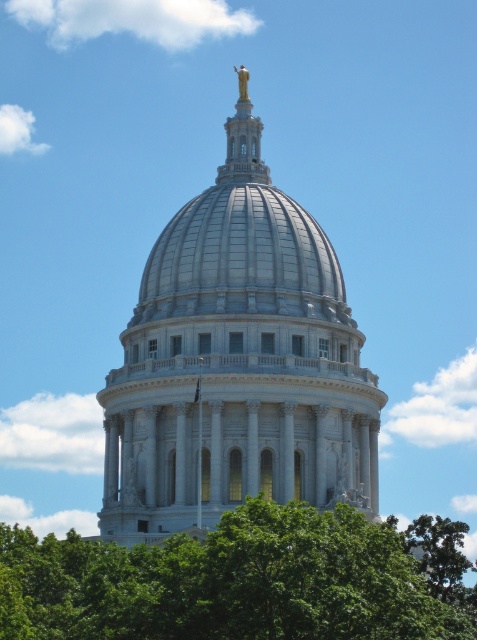
Is green leafy tree at lower center shorter than goldmaterial/texturestatue at upper center?

Correct, green leafy tree at lower center is not as tall as goldmaterial/texturestatue at upper center.

Who is taller, green leafy tree at lower center or goldmaterial/texturestatue at upper center?

goldmaterial/texturestatue at upper center is taller.

Identify the location of green leafy tree at lower center. The height and width of the screenshot is (640, 477). (227, 582).

Between white marble dome at center and goldmaterial/texturestatue at upper center, which one appears on the left side from the viewer's perspective?

white marble dome at center

Who is more distant from viewer, (306, 458) or (232, 125)?

The point (232, 125) is more distant.

The image size is (477, 640). I want to click on white marble dome at center, so click(x=237, y=372).

Where is `white marble dome at center`? The height and width of the screenshot is (640, 477). white marble dome at center is located at coordinates pyautogui.click(x=237, y=372).

Based on the photo, does white marble dome at center appear over green leafy tree at lower center?

Indeed, white marble dome at center is positioned over green leafy tree at lower center.

Locate an element on the screen. This screenshot has height=640, width=477. white marble dome at center is located at coordinates (237, 372).